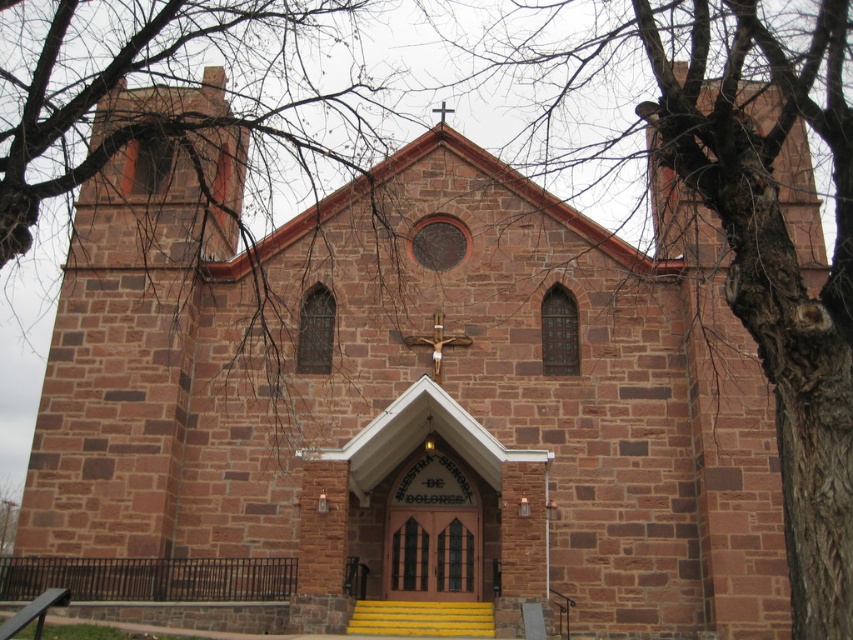
Question: Is bare branches at center positioned behind bark textured tree at upper center?

Choices:
 (A) yes
 (B) no

Answer: (A)

Question: From the image, what is the correct spatial relationship of bare branches at center in relation to yellow painted wood stairs at center?

Choices:
 (A) left
 (B) right

Answer: (A)

Question: In this image, where is bare branches at center located relative to yellow painted wood stairs at center?

Choices:
 (A) left
 (B) right

Answer: (A)

Question: Among these objects, which one is nearest to the camera?

Choices:
 (A) bark textured tree at upper center
 (B) yellow painted wood stairs at center
 (C) bare branches at center

Answer: (A)

Question: Among these objects, which one is farthest from the camera?

Choices:
 (A) bark textured tree at upper center
 (B) yellow painted wood stairs at center

Answer: (B)

Question: Among these points, which one is farthest from the camera?

Choices:
 (A) (195, 36)
 (B) (776, 326)
 (C) (430, 621)

Answer: (A)